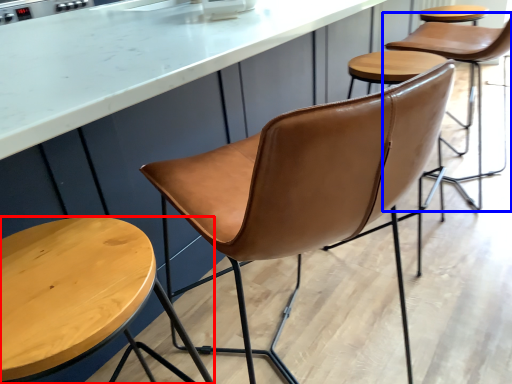
Question: Which object appears closest to the camera in this image, stool (highlighted by a red box) or chair (highlighted by a blue box)?

Choices:
 (A) stool
 (B) chair

Answer: (A)